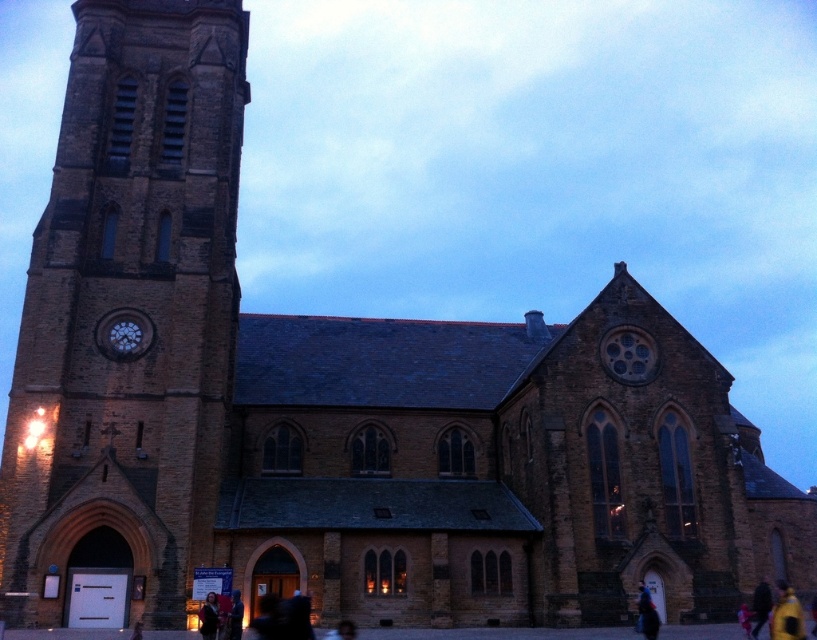
Which is behind, point (92, 298) or point (650, 625)?

Positioned behind is point (92, 298).

Who is more forward, [105,420] or [659,624]?

Point [659,624]

You are a GUI agent. You are given a task and a screenshot of the screen. Output one action in this format:
    pyautogui.click(x=<x>, y=<y>)
    Task: Click on the brown stone tower at left
    The image size is (817, 640).
    Given the screenshot: What is the action you would take?
    pyautogui.click(x=128, y=316)

In the scene shown: Does brown stone tower at left appear on the right side of dark brown leather jacket at center?

Incorrect, brown stone tower at left is not on the right side of dark brown leather jacket at center.

Measure the distance between brown stone tower at left and camera.

43.88 meters

Locate an element on the screen. brown stone tower at left is located at coordinates (128, 316).

Does yellow fabric bag at lower right have a smaller size compared to dark blue jacket at lower right?

No.

This screenshot has width=817, height=640. I want to click on yellow fabric bag at lower right, so click(786, 614).

Locate an element on the screen. The height and width of the screenshot is (640, 817). yellow fabric bag at lower right is located at coordinates (786, 614).